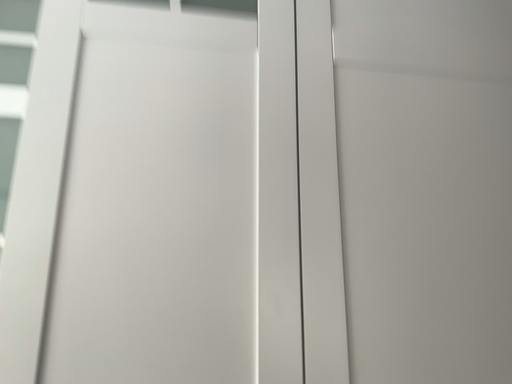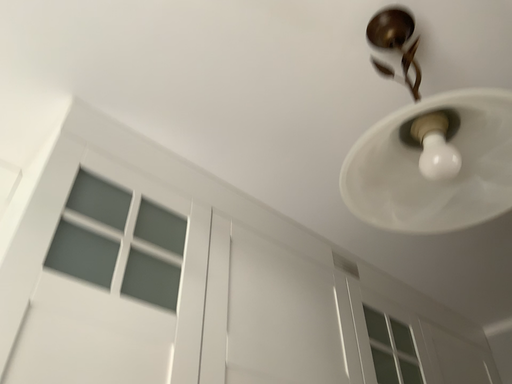
Question: How did the camera likely rotate when shooting the video?

Choices:
 (A) rotated left
 (B) rotated right

Answer: (B)